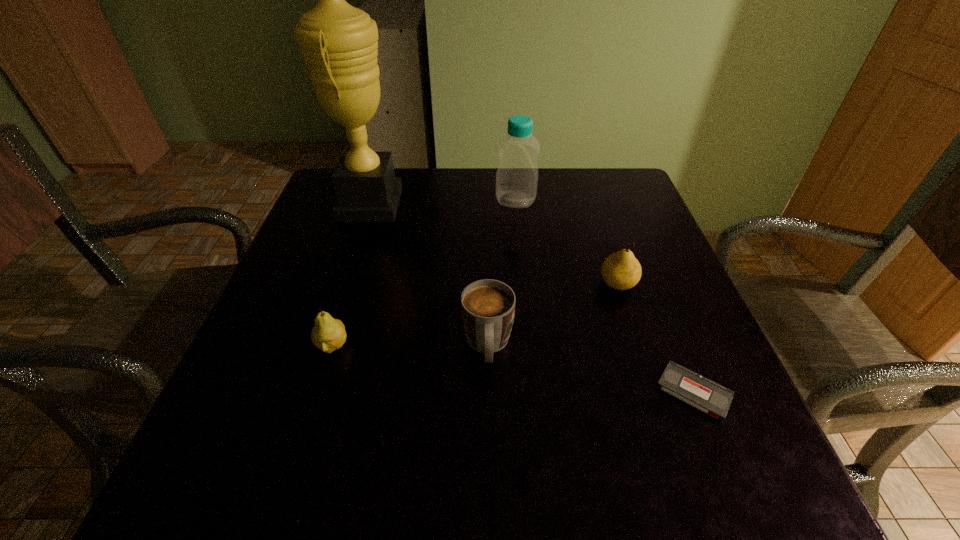
Locate an element on the screen. The image size is (960, 540). free space at the far edge is located at coordinates (472, 201).

Identify the location of vacant space at the left edge of the desktop. (347, 295).

Image resolution: width=960 pixels, height=540 pixels. In order to click on vacant region at the right edge in this screenshot , I will do `click(660, 272)`.

Where is `free spot at the near left corner of the desktop`? free spot at the near left corner of the desktop is located at coordinates (228, 497).

This screenshot has height=540, width=960. Find the location of `free space at the far right corner of the desktop`. free space at the far right corner of the desktop is located at coordinates [x=605, y=186].

Where is `vacant area that lies between the bottle and the tallest object`? vacant area that lies between the bottle and the tallest object is located at coordinates (443, 202).

Locate an element on the screen. free space between the mug and the tallest object is located at coordinates (429, 275).

Locate an element on the screen. Image resolution: width=960 pixels, height=540 pixels. vacant area that lies between the fifth shortest object and the tallest object is located at coordinates pyautogui.click(x=443, y=202).

Image resolution: width=960 pixels, height=540 pixels. I want to click on free space between the mug and the second tallest object, so click(502, 273).

Identify the location of vacant space in between the bottle and the shortest object. (605, 296).